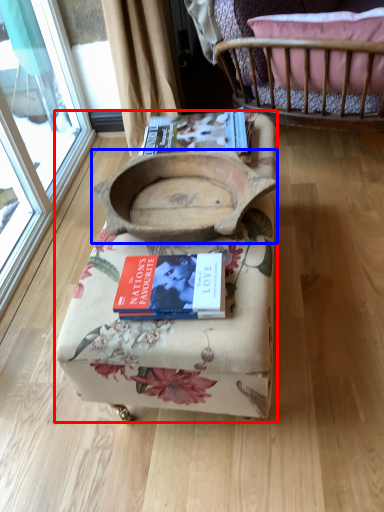
Question: Among these objects, which one is farthest to the camera, furniture (highlighted by a red box) or infant bed (highlighted by a blue box)?

Choices:
 (A) furniture
 (B) infant bed

Answer: (B)